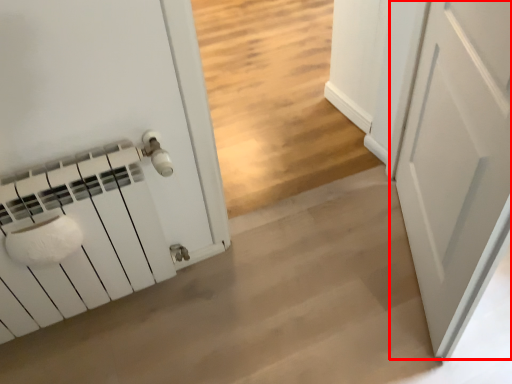
Question: From the image's perspective, what is the correct spatial relationship of door (annotated by the red box) in relation to concrete?

Choices:
 (A) below
 (B) above

Answer: (B)